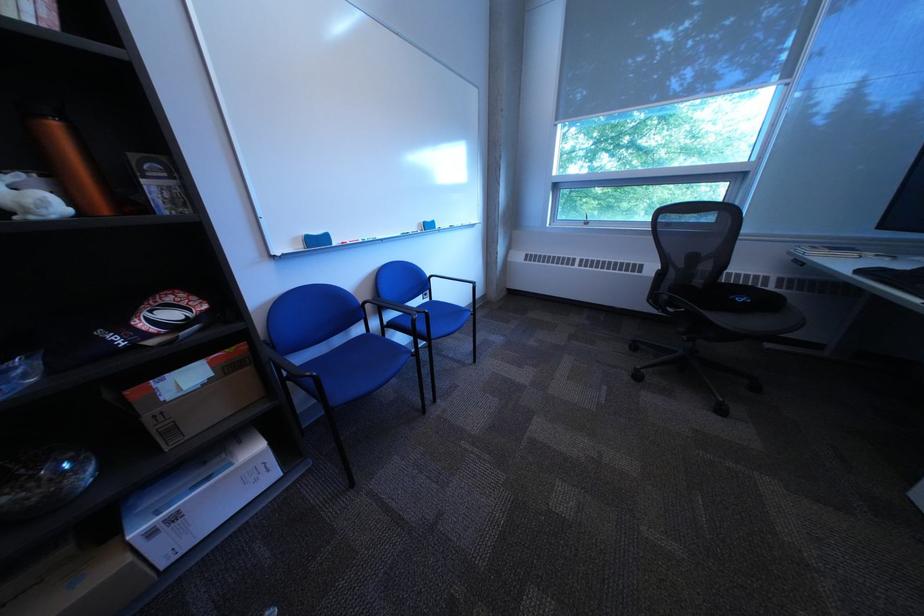
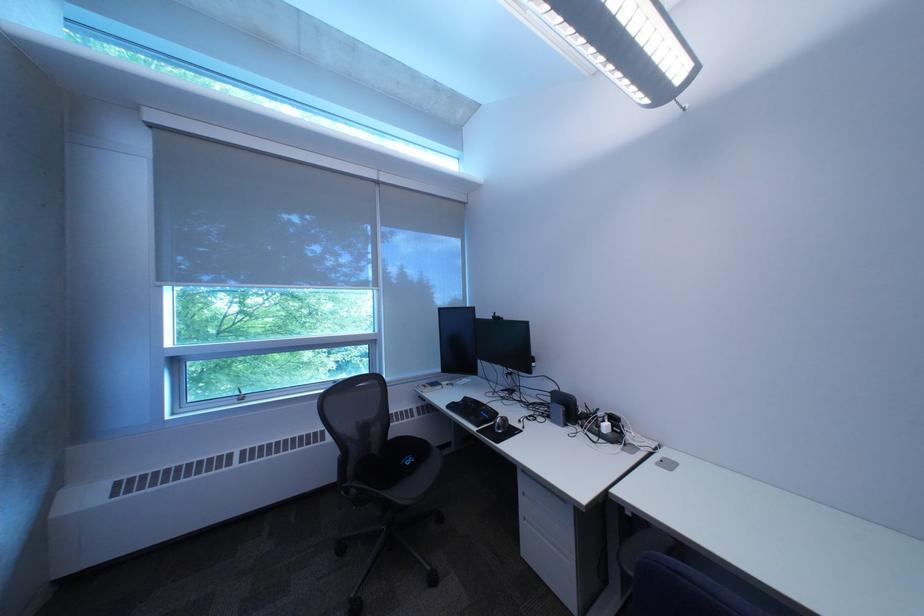
In the second image, find the point that corresponds to [877,274] in the first image.

(464, 408)